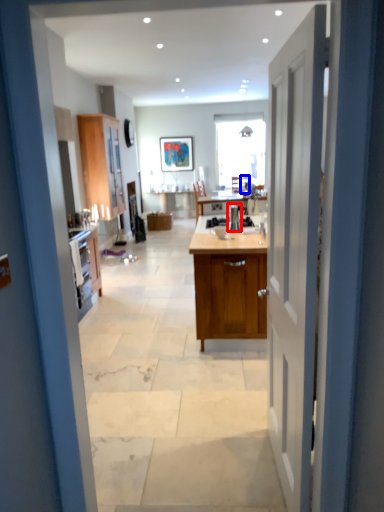
Question: Which object appears closest to the camera in this image, appliance (highlighted by a red box) or chair (highlighted by a blue box)?

Choices:
 (A) appliance
 (B) chair

Answer: (A)